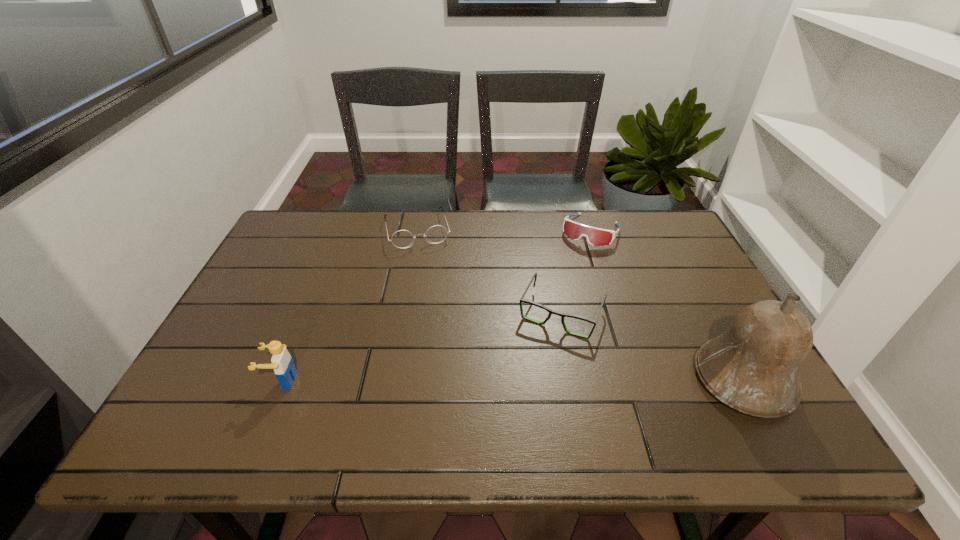
This screenshot has height=540, width=960. Identify the location of free point between the left spectacles and the rightmost object. (581, 305).

Where is `free space between the left spectacles and the goggles`? The height and width of the screenshot is (540, 960). free space between the left spectacles and the goggles is located at coordinates (504, 230).

This screenshot has width=960, height=540. In order to click on unoccupied position between the bell and the fourth object from right to left in this screenshot , I will do `click(581, 305)`.

Choose which object is the second nearest neighbor to the tallest object. Please provide its 2D coordinates. Your answer should be formatted as a tuple, i.e. [(x, y)], where the tuple contains the x and y coordinates of a point satisfying the conditions above.

[(595, 236)]

Identify which object is the third closest to the bell. Please provide its 2D coordinates. Your answer should be formatted as a tuple, i.e. [(x, y)], where the tuple contains the x and y coordinates of a point satisfying the conditions above.

[(401, 239)]

Identify the location of free space in the image that satisfies the following two spatial constraints: 1. on the front side of the farther spectacles; 2. on the right side of the goggles. (418, 231).

You are a GUI agent. You are given a task and a screenshot of the screen. Output one action in this format:
    pyautogui.click(x=<x>, y=<y>)
    Task: Click on the free point that satisfies the following two spatial constraints: 1. on the front side of the nearer spectacles; 2. on the right side of the bell
    The width and height of the screenshot is (960, 540).
    Given the screenshot: What is the action you would take?
    pyautogui.click(x=574, y=380)

Image resolution: width=960 pixels, height=540 pixels. In order to click on free point that satisfies the following two spatial constraints: 1. on the front side of the right spectacles; 2. on the right side of the bell in this screenshot , I will do `click(574, 380)`.